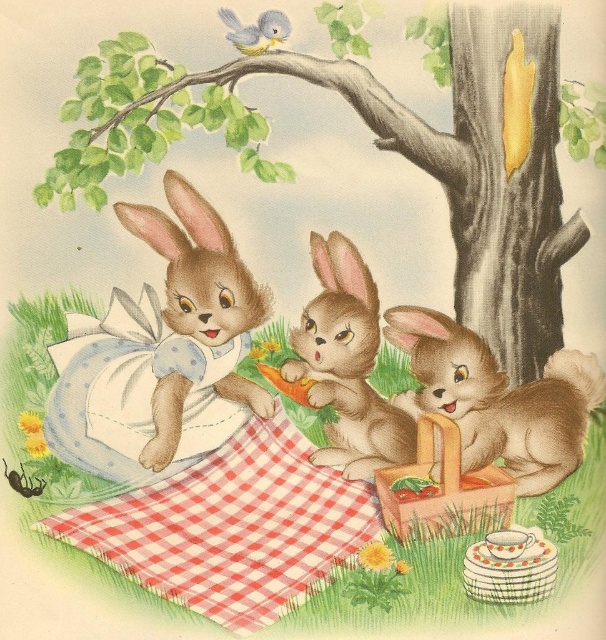
You are standing in the picnic scene and want to pick up an item from the picnic blanket. There are two points marked on the blanket. Which point is closer to you, point (211, 588) or point (364, 264)?

Point (211, 588) is closer to you than point (364, 264).